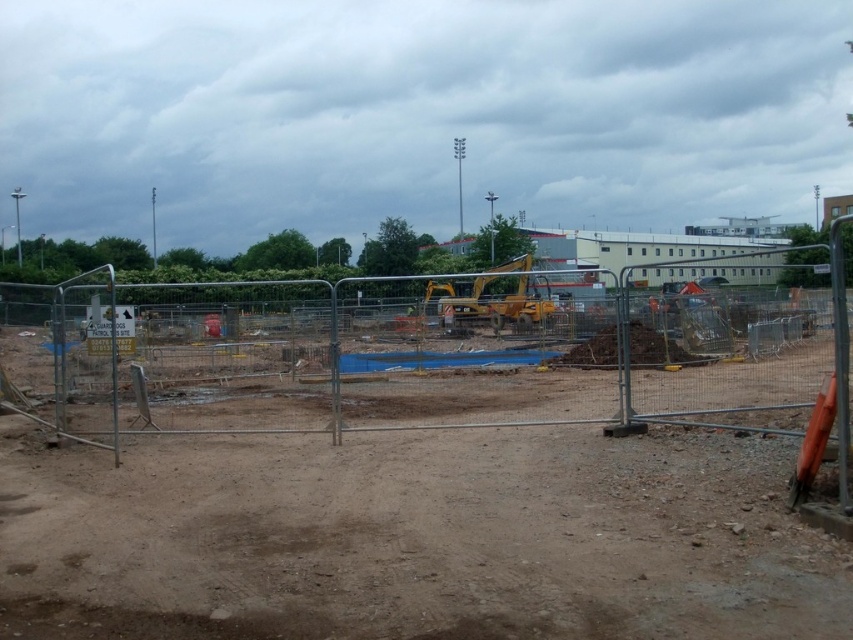
You are a construction worker planning to place a large equipment container that requires a flat, open space. Based on the scene, which area between the brown dirt at center and the metal fence at center would be more suitable for placing the container?

The metal fence at center occupies more space than the brown dirt at center, so the metal fence at center area would be more suitable for placing the container as it provides a larger flat area.